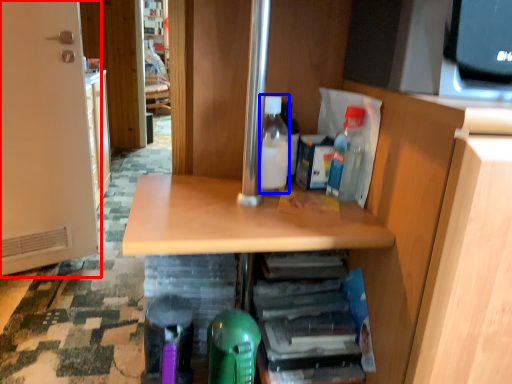
Question: Among these objects, which one is nearest to the camera, door (highlighted by a red box) or bottle (highlighted by a blue box)?

Choices:
 (A) door
 (B) bottle

Answer: (B)